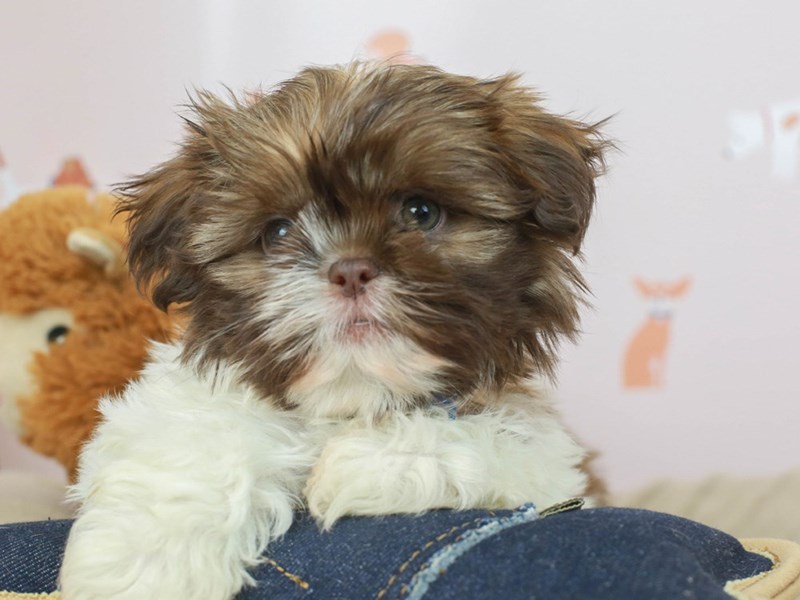
The image size is (800, 600). Identify the location of animals painted on the wall. (646, 343), (389, 40), (78, 177), (786, 137).